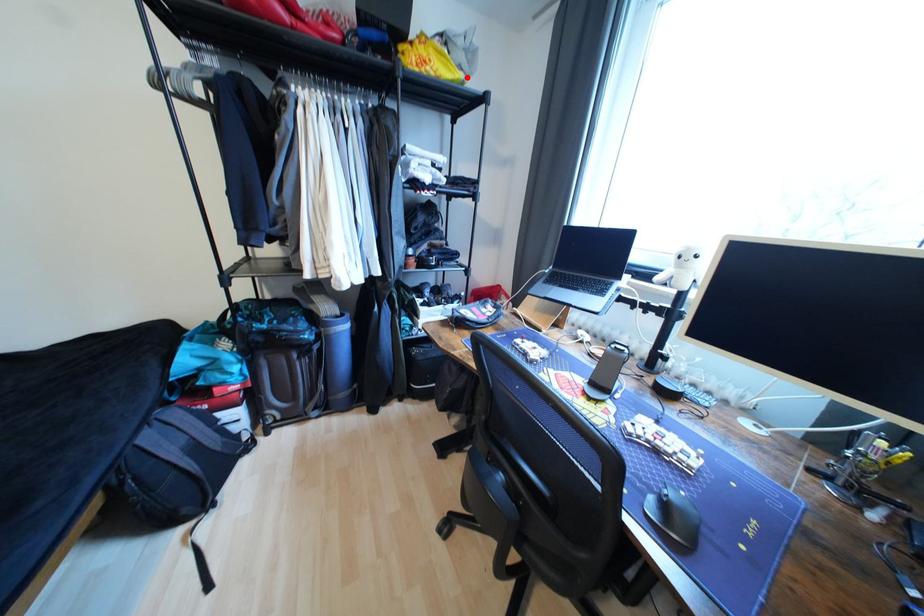
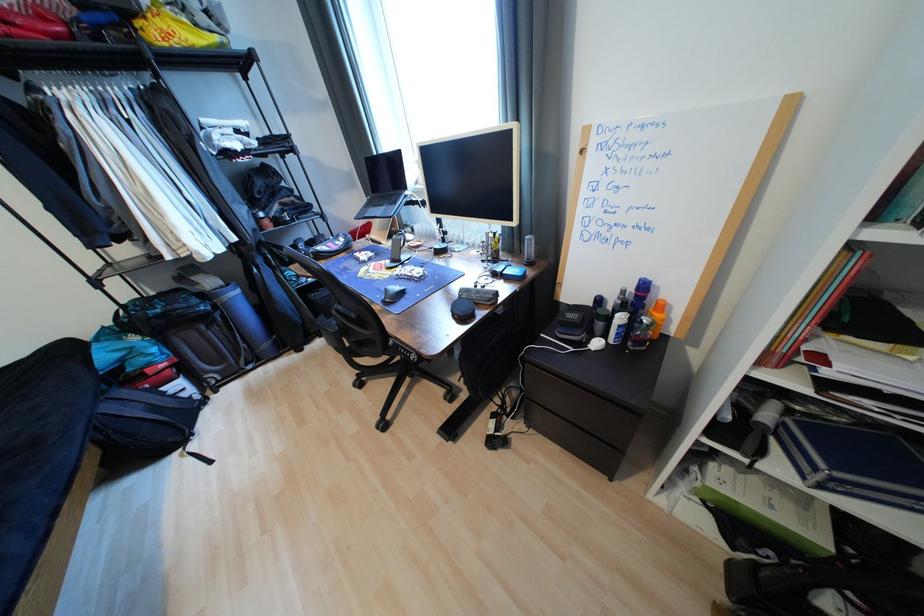
Question: I am providing you with two images of the same scene from different viewpoints. Image1 has a red point marked. In image2, the corresponding 3D location appears at what relative position? Reply with the corresponding letter.

Choices:
 (A) Closer
 (B) Farther

Answer: (B)